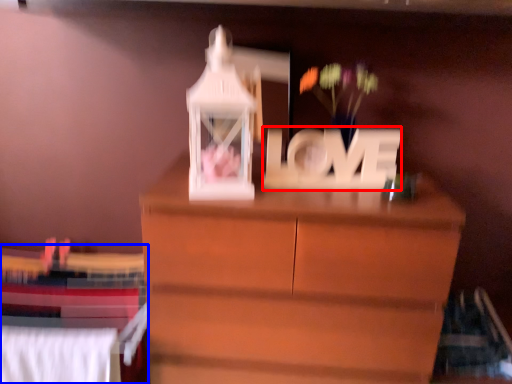
Question: Which of the following is the farthest to the observer, letter (highlighted by a red box) or bed (highlighted by a blue box)?

Choices:
 (A) letter
 (B) bed

Answer: (B)